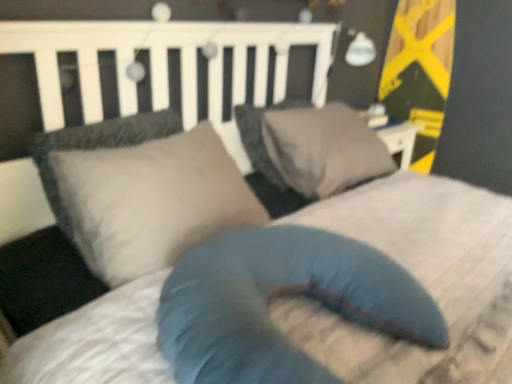
Question: From the image's perspective, is matte gray pillow at center, which appears as the 2th pillow when viewed from the back, beneath gray fabric pillow at center, which is the first pillow in back-to-front order?

Choices:
 (A) yes
 (B) no

Answer: (A)

Question: Would you say matte gray pillow at center, the 2th pillow from the front, is outside gray fabric pillow at center, which is the first pillow in back-to-front order?

Choices:
 (A) no
 (B) yes

Answer: (B)

Question: Is matte gray pillow at center, which appears as the 2th pillow when viewed from the back, surrounding gray fabric pillow at center, which appears as the third pillow when viewed from the front?

Choices:
 (A) no
 (B) yes

Answer: (A)

Question: Is matte gray pillow at center, the 2th pillow from the front, directly adjacent to gray fabric pillow at center, which is the first pillow in back-to-front order?

Choices:
 (A) yes
 (B) no

Answer: (B)

Question: Does matte gray pillow at center, which appears as the 2th pillow when viewed from the back, have a greater width compared to gray fabric pillow at center, which appears as the third pillow when viewed from the front?

Choices:
 (A) no
 (B) yes

Answer: (A)

Question: Is gray fabric pillow at center, which is the first pillow in back-to-front order, inside or outside of blue fabric pillow at center, which is the first pillow in front-to-back order?

Choices:
 (A) outside
 (B) inside

Answer: (A)

Question: Considering the positions of gray fabric pillow at center, which is the first pillow in back-to-front order, and blue fabric pillow at center, the 3th pillow from the back, in the image, is gray fabric pillow at center, which is the first pillow in back-to-front order, taller or shorter than blue fabric pillow at center, the 3th pillow from the back,?

Choices:
 (A) short
 (B) tall

Answer: (B)

Question: Based on their sizes in the image, would you say gray fabric pillow at center, which appears as the third pillow when viewed from the front, is bigger or smaller than blue fabric pillow at center, the 3th pillow from the back?

Choices:
 (A) small
 (B) big

Answer: (A)

Question: In the image, is gray fabric pillow at center, which appears as the third pillow when viewed from the front, on the left side or the right side of blue fabric pillow at center, the 3th pillow from the back?

Choices:
 (A) left
 (B) right

Answer: (B)

Question: Is matte gray pillow at center, the 2th pillow from the front, taller or shorter than gray fabric pillow at center, which is the first pillow in back-to-front order?

Choices:
 (A) short
 (B) tall

Answer: (B)

Question: Is matte gray pillow at center, the 2th pillow from the front, inside or outside of gray fabric pillow at center, which is the first pillow in back-to-front order?

Choices:
 (A) inside
 (B) outside

Answer: (B)

Question: Considering their positions, is matte gray pillow at center, the 2th pillow from the front, located in front of or behind gray fabric pillow at center, which is the first pillow in back-to-front order?

Choices:
 (A) front
 (B) behind

Answer: (A)

Question: Considering the positions of matte gray pillow at center, which appears as the 2th pillow when viewed from the back, and gray fabric pillow at center, which is the first pillow in back-to-front order, in the image, is matte gray pillow at center, which appears as the 2th pillow when viewed from the back, wider or thinner than gray fabric pillow at center, which is the first pillow in back-to-front order,?

Choices:
 (A) thin
 (B) wide

Answer: (A)

Question: Looking at their shapes, would you say gray fabric pillow at center, which appears as the third pillow when viewed from the front, is wider or thinner than matte gray pillow at center, the 2th pillow from the front?

Choices:
 (A) thin
 (B) wide

Answer: (B)

Question: Does point (352, 180) appear closer or farther from the camera than point (172, 144)?

Choices:
 (A) closer
 (B) farther

Answer: (B)